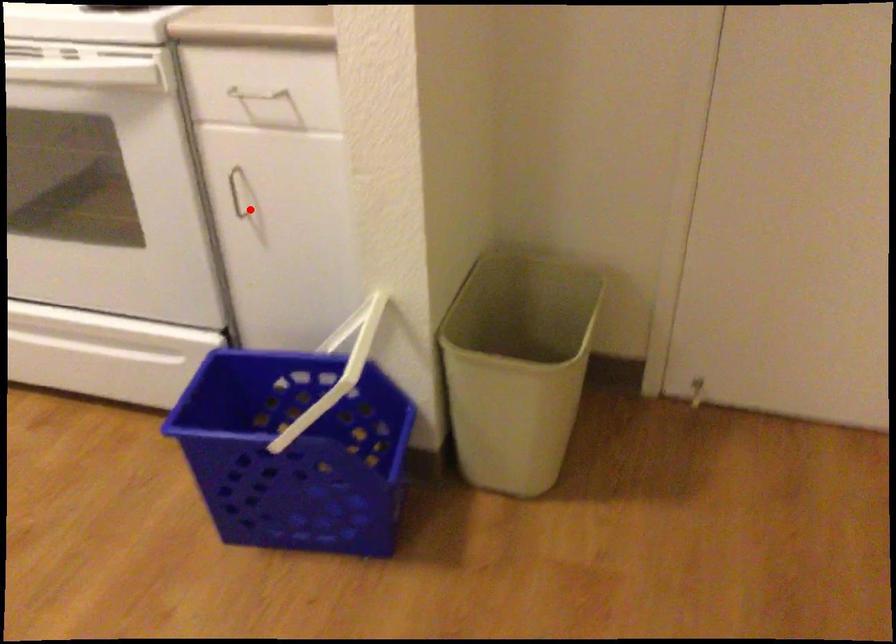
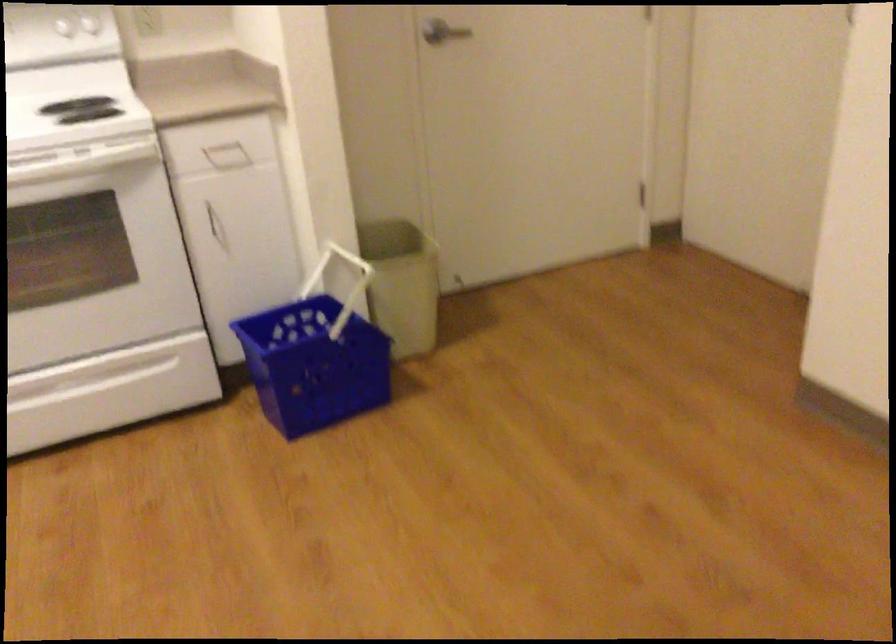
Find the pixel in the second image that matches the highlighted location in the first image.

(216, 225)